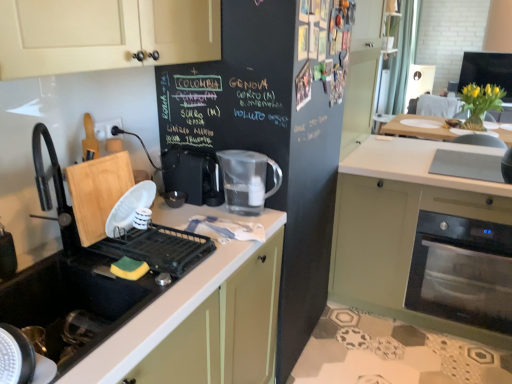
Locate an element on the screen. vacant space in front of transparent plastic pitcher at center is located at coordinates (246, 230).